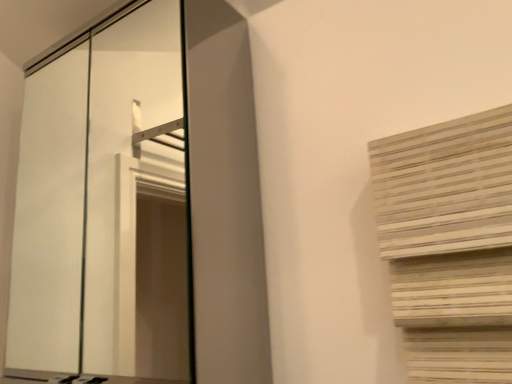
Measure the distance between white glossy screen door at upper left and camera.

The distance of white glossy screen door at upper left from camera is 33.50 inches.

Identify the location of white glossy screen door at upper left. (104, 208).

Describe the element at coordinates (104, 208) in the screenshot. I see `white glossy screen door at upper left` at that location.

Where is `white glossy screen door at upper left`? This screenshot has width=512, height=384. white glossy screen door at upper left is located at coordinates (104, 208).